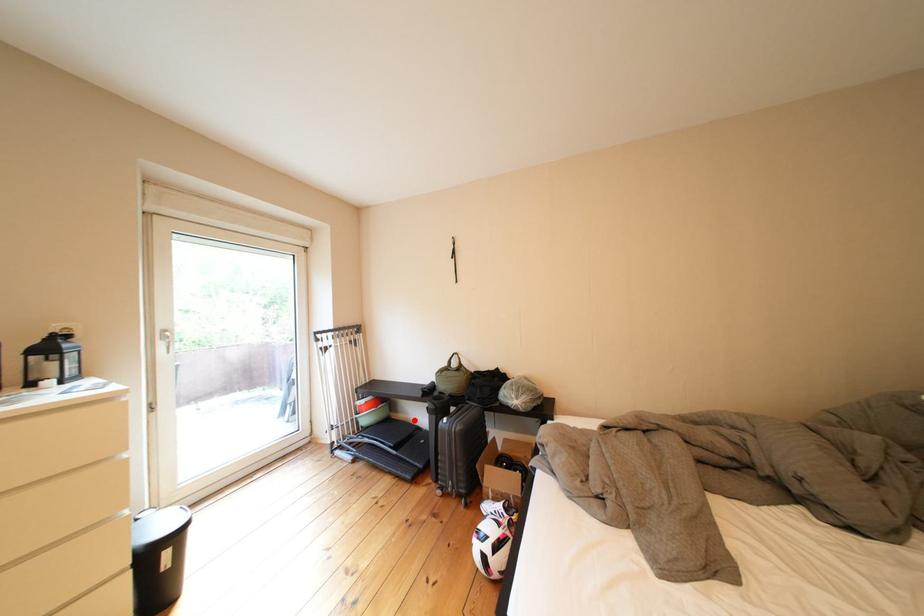
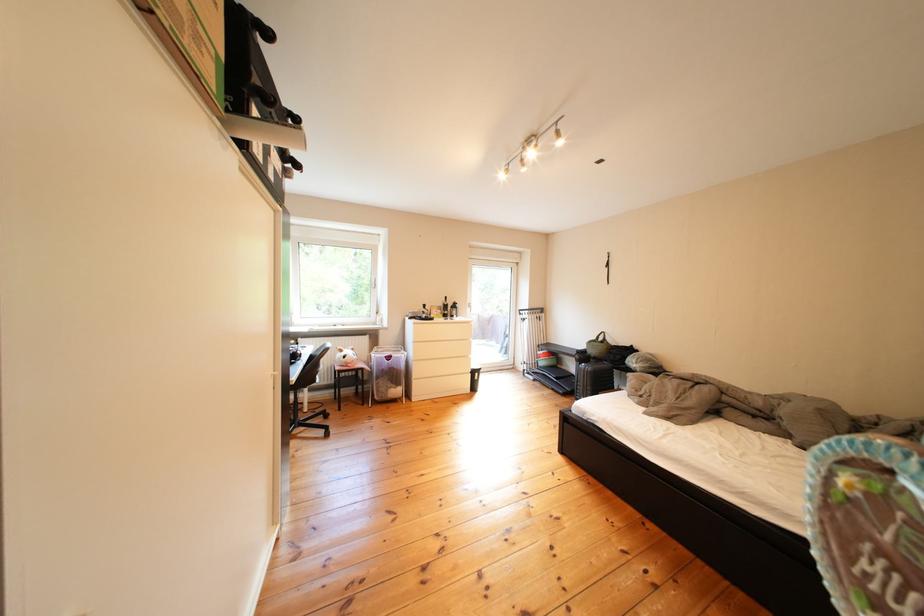
Question: I am providing you with two images of the same scene from different viewpoints. In image1, a red point is highlighted. Considering the same 3D point in image2, which of the following is correct?

Choices:
 (A) It is closer
 (B) It is farther

Answer: (A)